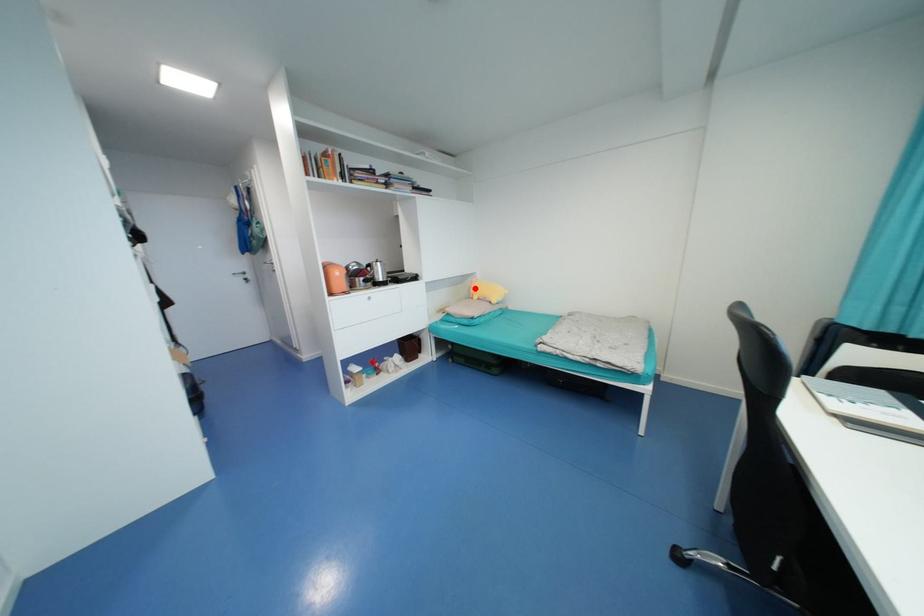
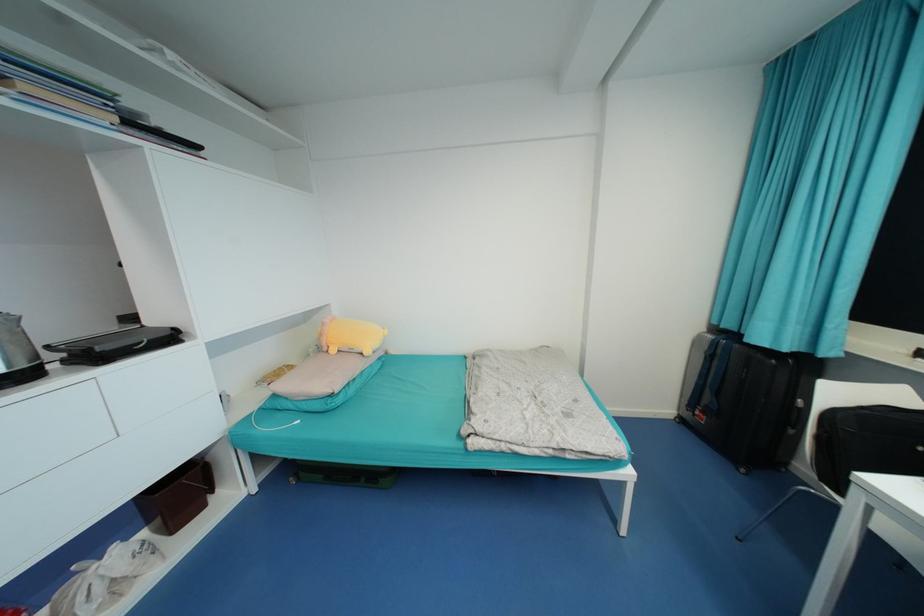
Where in the second image is the point corresponding to the highlighted location from the first image?

(325, 334)